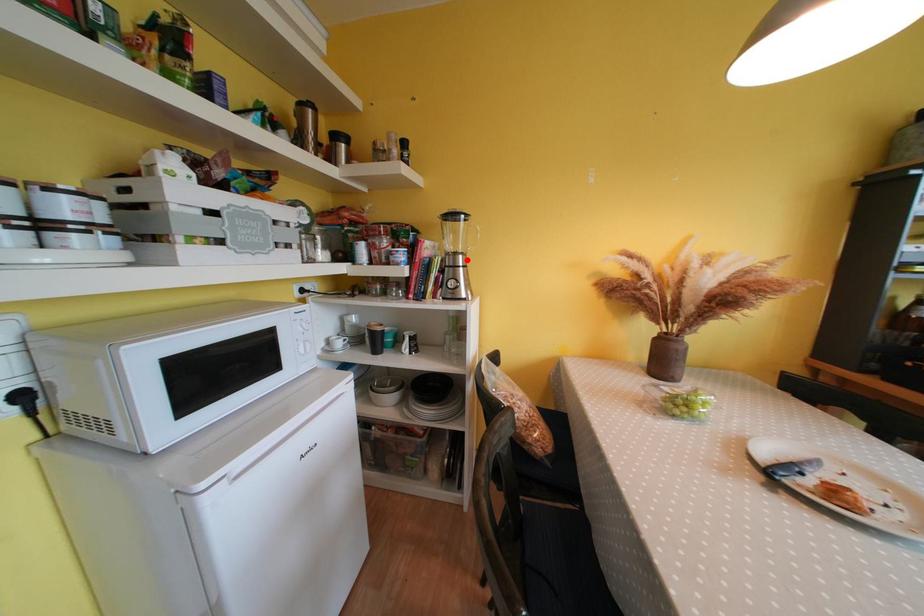
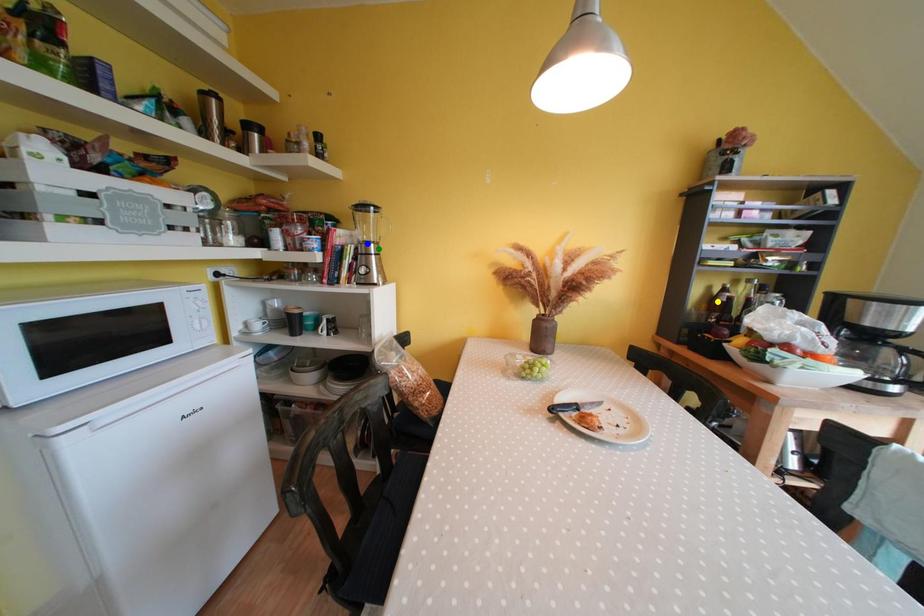
Question: I am providing you with two images of the same scene from different viewpoints. A red point is marked on the first image. You are given multiple points on the second image. Which point in image 2 is actually the same real-world point as the red point in image 1?

Choices:
 (A) blue point
 (B) yellow point
 (C) green point

Answer: (C)